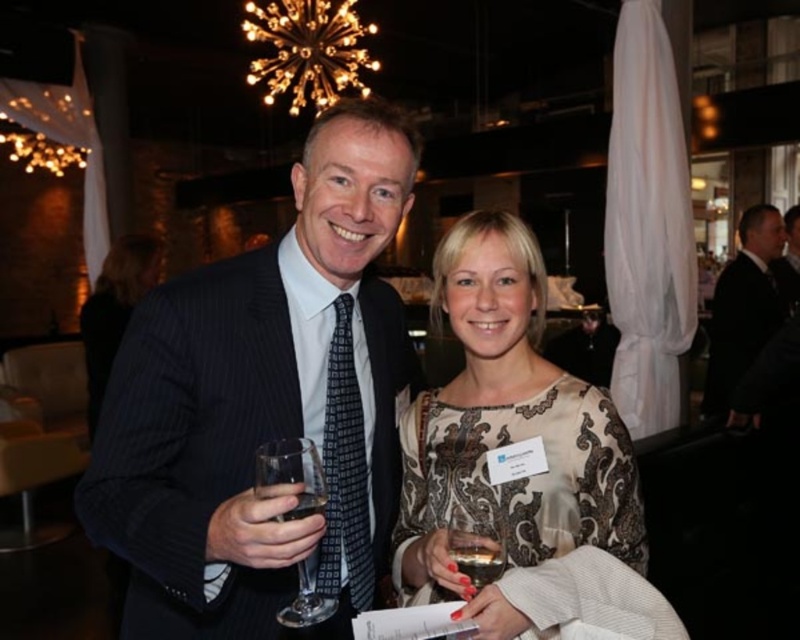
You are a photographer standing at the event. You want to take a closeup shot of the matte black suit at center without moving the subject. Can you do it with a standard camera lens that has a minimum focusing distance of 50 centimeters?

The matte black suit at center is 84.60 centimeters away from the viewer. Since the minimum focusing distance of the standard camera lens is 50 centimeters, the photographer can take the closeup shot as the distance is within the lens capability.

Consider the image. You are a photographer at a formal event. You want to take a photo of the black suit at right and the transparent glass at center. The camera you are using has a maximum focus range of 3.5 meters. Will you be able to capture both subjects in focus at the same time?

The distance between the black suit at right and the transparent glass at center is 3.66 meters. Since the camera can only focus up to 3.5 meters, it will not be able to capture both subjects in focus simultaneously.

You are a photographer at the event and want to position a spotlight exactly at the location of the matte black suit at center. What are the coordinates where you should place the spotlight?

The coordinates for the matte black suit at center are at point [264,403], so place the spotlight there.